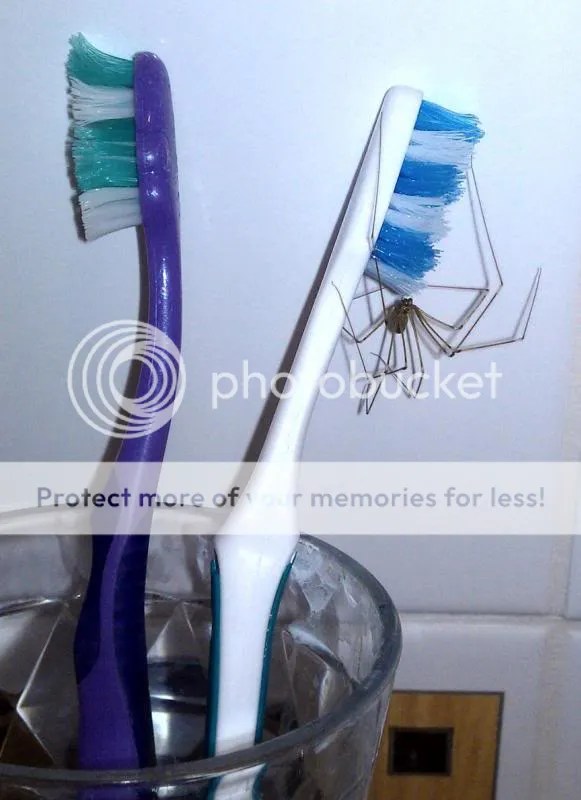
The width and height of the screenshot is (581, 800). In order to click on grout in this screenshot , I will do `click(543, 710)`.